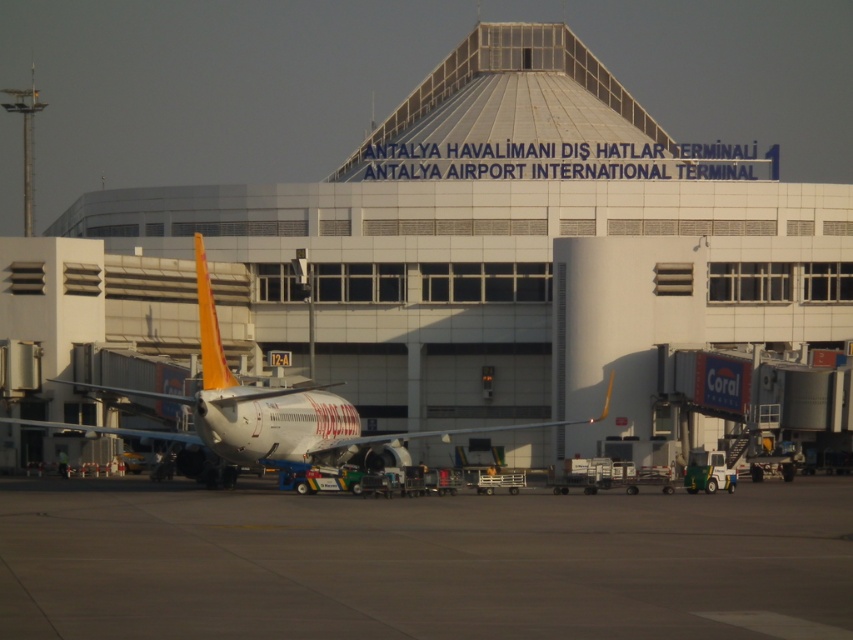
You are standing at the point with coordinates point (488, 269) in front of the Antalya Airport International Terminal. What is the nearest object to you?

The point (488, 269) corresponds to the white concrete building at center, so the nearest object to you is the white concrete building at center.

From the picture: You are a passenger standing at the entrance of the white concrete building at center and want to board the white glossy airplane at center. Which direction should you walk towards?

You should walk towards the right side since the white concrete building at center is positioned on the left side of the white glossy airplane at center.

You are standing at point (488, 269) in the Antalya Airport International Terminal. Which direction should you walk to reach the white concrete building at center?

The white concrete building at center is located at point (488, 269), so you are already at the white concrete building at center.